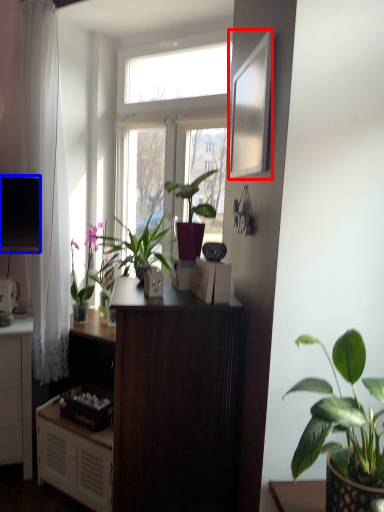
Question: Which object appears farthest to the camera in this image, picture frame (highlighted by a red box) or television (highlighted by a blue box)?

Choices:
 (A) picture frame
 (B) television

Answer: (B)